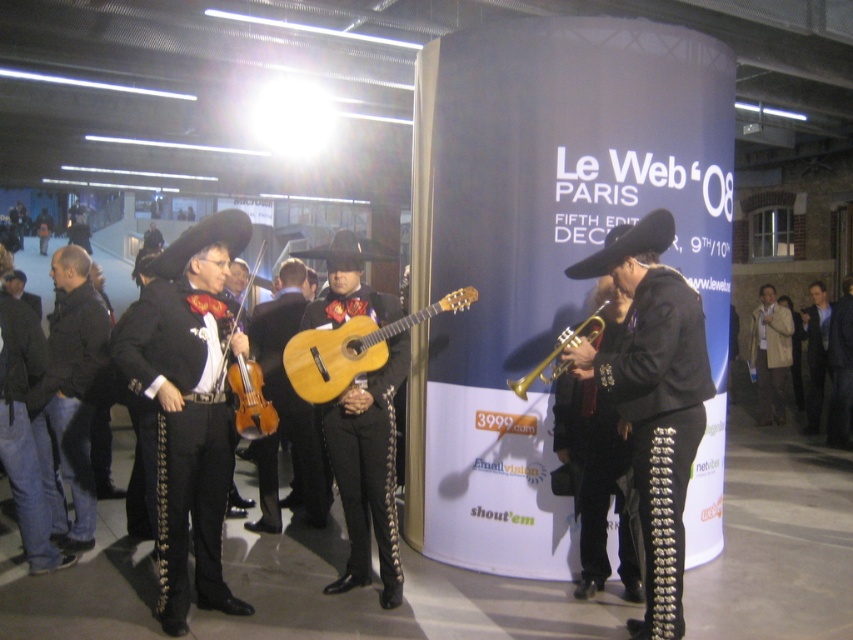
Question: Which object appears closest to the camera in this image?

Choices:
 (A) matte wood guitar at center
 (B) light beige fabric coat at right
 (C) black leather pants at right

Answer: (C)

Question: Can you confirm if matte wood guitar at center is bigger than black leather jacket at left?

Choices:
 (A) no
 (B) yes

Answer: (B)

Question: Can you confirm if black leather pants at right is bigger than gold shiny trumpet at center?

Choices:
 (A) yes
 (B) no

Answer: (A)

Question: Which point is closer to the camera?

Choices:
 (A) matte black violin at center
 (B) light beige fabric coat at right

Answer: (A)

Question: Which point is closer to the camera taking this photo?

Choices:
 (A) (93, 323)
 (B) (288, 337)

Answer: (A)

Question: Does black leather pants at right appear on the right side of light beige fabric coat at right?

Choices:
 (A) no
 (B) yes

Answer: (A)